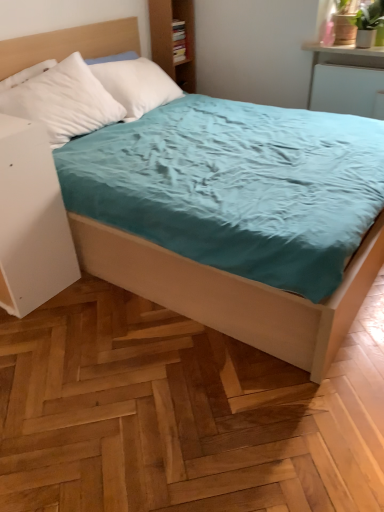
Question: Is white matte nightstand at left positioned behind white glossy shelf at upper right?

Choices:
 (A) no
 (B) yes

Answer: (A)

Question: Is white matte nightstand at left to the left of white glossy shelf at upper right from the viewer's perspective?

Choices:
 (A) no
 (B) yes

Answer: (B)

Question: Does white matte nightstand at left have a greater width compared to white glossy shelf at upper right?

Choices:
 (A) no
 (B) yes

Answer: (A)

Question: Does white matte nightstand at left have a greater height compared to white glossy shelf at upper right?

Choices:
 (A) no
 (B) yes

Answer: (B)

Question: Is white matte nightstand at left not inside white glossy shelf at upper right?

Choices:
 (A) yes
 (B) no

Answer: (A)

Question: From a real-world perspective, does white matte nightstand at left sit lower than white glossy shelf at upper right?

Choices:
 (A) yes
 (B) no

Answer: (A)

Question: Does white glossy shelf at upper right have a lesser height compared to white matte nightstand at left?

Choices:
 (A) yes
 (B) no

Answer: (A)

Question: Is white glossy shelf at upper right wider than white matte nightstand at left?

Choices:
 (A) no
 (B) yes

Answer: (B)

Question: From a real-world perspective, is white glossy shelf at upper right on top of white matte nightstand at left?

Choices:
 (A) yes
 (B) no

Answer: (A)

Question: Can you confirm if white glossy shelf at upper right is positioned to the right of white matte nightstand at left?

Choices:
 (A) no
 (B) yes

Answer: (B)

Question: Would you consider white glossy shelf at upper right to be distant from white matte nightstand at left?

Choices:
 (A) no
 (B) yes

Answer: (B)

Question: From a real-world perspective, is white glossy shelf at upper right physically below white matte nightstand at left?

Choices:
 (A) yes
 (B) no

Answer: (B)

Question: Is white matte nightstand at left to the left or to the right of white glossy shelf at upper right in the image?

Choices:
 (A) left
 (B) right

Answer: (A)